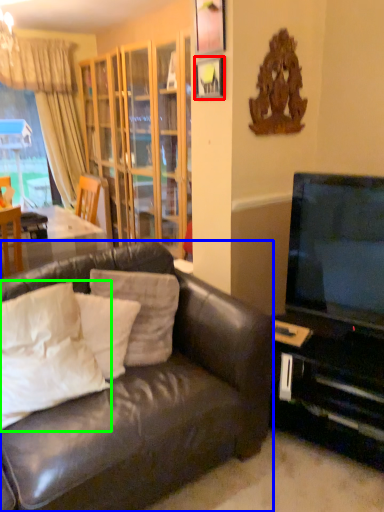
Question: Which object is positioned farthest from picture frame (highlighted by a red box)? Select from studio couch (highlighted by a blue box) and pillow (highlighted by a green box).

Choices:
 (A) studio couch
 (B) pillow

Answer: (B)